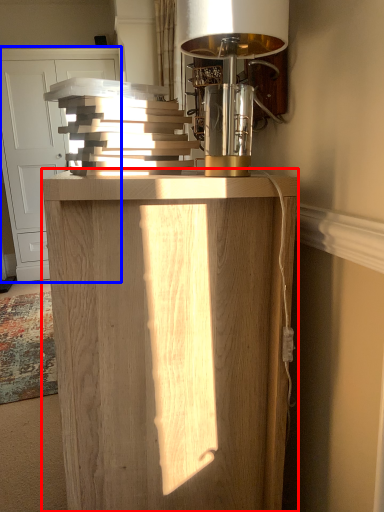
Question: Which of the following is the farthest to the observer, furniture (highlighted by a red box) or cabinetry (highlighted by a blue box)?

Choices:
 (A) furniture
 (B) cabinetry

Answer: (B)